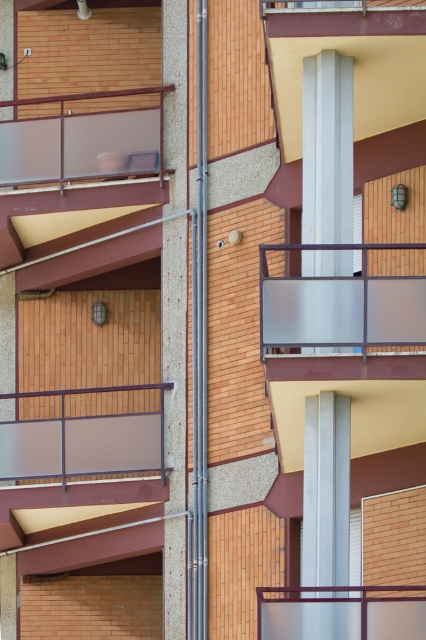
Question: Among these objects, which one is nearest to the camera?

Choices:
 (A) frosted glass balcony at center
 (B) frosted glass balustrade at lower center

Answer: (B)

Question: Which is farther from the clear glass balcony at upper center?

Choices:
 (A) frosted glass balustrade at lower center
 (B) matte gray glass balcony at center

Answer: (B)

Question: Which point is farther to the camera?

Choices:
 (A) (278, 621)
 (B) (264, 275)

Answer: (B)

Question: Can you confirm if frosted glass balcony at center is positioned to the right of matte gray glass balcony at center?

Choices:
 (A) yes
 (B) no

Answer: (A)

Question: Is matte gray glass balcony at center bigger than clear glass balcony at upper center?

Choices:
 (A) no
 (B) yes

Answer: (B)

Question: Can you confirm if frosted glass balcony at center is positioned above matte gray glass balcony at center?

Choices:
 (A) no
 (B) yes

Answer: (B)